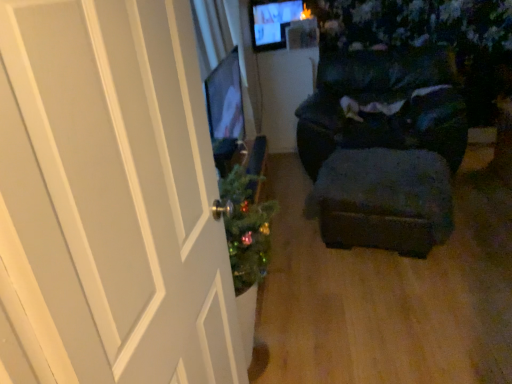
Question: Is dark fabric chair at center to the left of white wood door at left from the viewer's perspective?

Choices:
 (A) yes
 (B) no

Answer: (B)

Question: Considering the relative positions of dark fabric chair at center and white wood door at left in the image provided, is dark fabric chair at center to the right of white wood door at left from the viewer's perspective?

Choices:
 (A) no
 (B) yes

Answer: (B)

Question: Is dark fabric chair at center wider than white wood door at left?

Choices:
 (A) yes
 (B) no

Answer: (A)

Question: From the image's perspective, is dark fabric chair at center beneath white wood door at left?

Choices:
 (A) yes
 (B) no

Answer: (B)

Question: Can you confirm if dark fabric chair at center is shorter than white wood door at left?

Choices:
 (A) yes
 (B) no

Answer: (A)

Question: Is the position of dark fabric chair at center more distant than that of white wood door at left?

Choices:
 (A) no
 (B) yes

Answer: (B)

Question: Does dark fabric chair at center have a lesser width compared to velvet dark blue stool at center?

Choices:
 (A) no
 (B) yes

Answer: (A)

Question: Considering the relative sizes of dark fabric chair at center and velvet dark blue stool at center in the image provided, is dark fabric chair at center smaller than velvet dark blue stool at center?

Choices:
 (A) no
 (B) yes

Answer: (A)

Question: Does dark fabric chair at center appear on the left side of velvet dark blue stool at center?

Choices:
 (A) yes
 (B) no

Answer: (B)

Question: Is dark fabric chair at center oriented away from velvet dark blue stool at center?

Choices:
 (A) no
 (B) yes

Answer: (A)

Question: Considering the relative sizes of dark fabric chair at center and velvet dark blue stool at center in the image provided, is dark fabric chair at center taller than velvet dark blue stool at center?

Choices:
 (A) no
 (B) yes

Answer: (B)

Question: Is dark fabric chair at center wider than velvet dark blue stool at center?

Choices:
 (A) no
 (B) yes

Answer: (B)

Question: Would you say white wood door at left is part of velvet dark blue stool at center's contents?

Choices:
 (A) yes
 (B) no

Answer: (B)